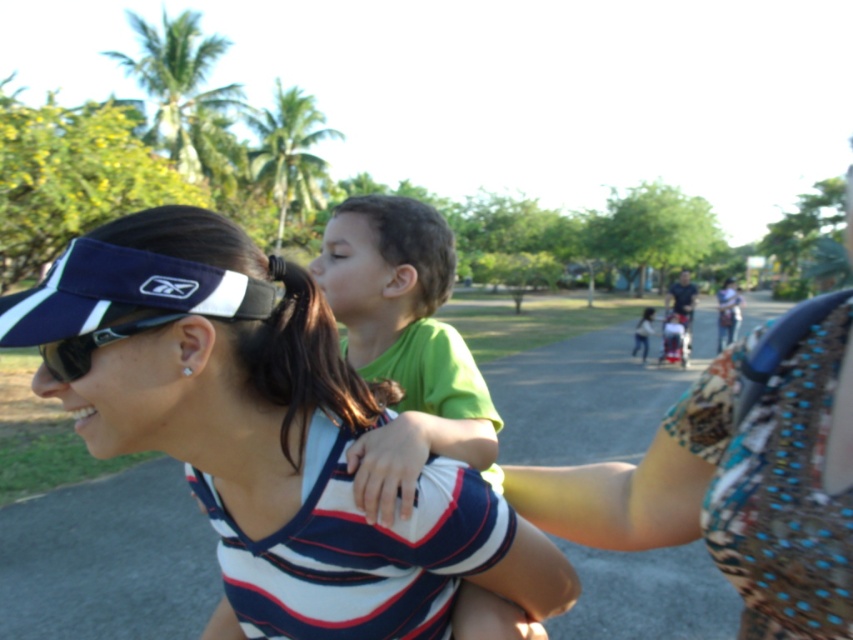
Is green matte shirt at center shorter than polka dot fabric at center?

In fact, green matte shirt at center may be taller than polka dot fabric at center.

Describe the element at coordinates (276, 420) in the screenshot. The height and width of the screenshot is (640, 853). I see `green matte shirt at center` at that location.

Where is `green matte shirt at center`? The height and width of the screenshot is (640, 853). green matte shirt at center is located at coordinates (276, 420).

In the scene shown: Who is shorter, navy blue fabric visor at upper left or sunglasses at left?

sunglasses at left is shorter.

Does navy blue fabric visor at upper left lie behind sunglasses at left?

No, it is not.

Where is `navy blue fabric visor at upper left`? navy blue fabric visor at upper left is located at coordinates (123, 292).

Locate an element on the screen. This screenshot has height=640, width=853. navy blue fabric visor at upper left is located at coordinates (123, 292).

Is green matte shirt at center positioned in front of sunglasses at left?

That is True.

Is green matte shirt at center further to camera compared to sunglasses at left?

No, green matte shirt at center is closer to the viewer.

Is point (265, 397) behind point (112, 330)?

Yes, point (265, 397) is behind point (112, 330).

Identify the location of green matte shirt at center. (276, 420).